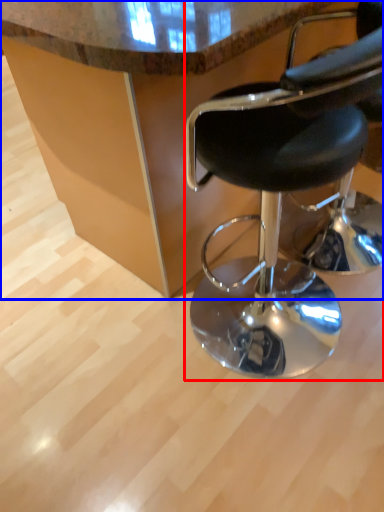
Question: Which of the following is the closest to the observer, chair (highlighted by a red box) or table (highlighted by a blue box)?

Choices:
 (A) chair
 (B) table

Answer: (A)